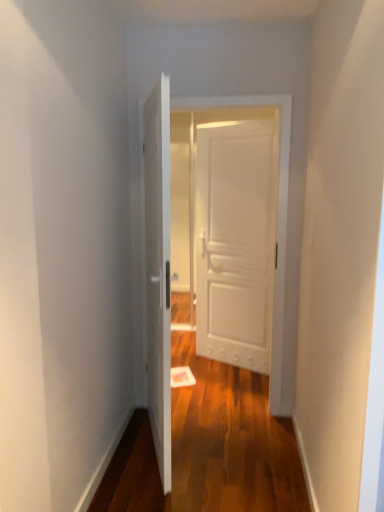
This screenshot has height=512, width=384. Identify the location of free location to the right of white matte door at center, which is the third door in back-to-front order. (232, 436).